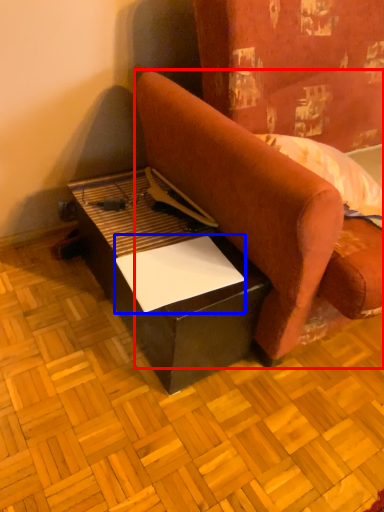
Question: Which point is closer to the camera, studio couch (highlighted by a red box) or paper (highlighted by a blue box)?

Choices:
 (A) studio couch
 (B) paper

Answer: (A)